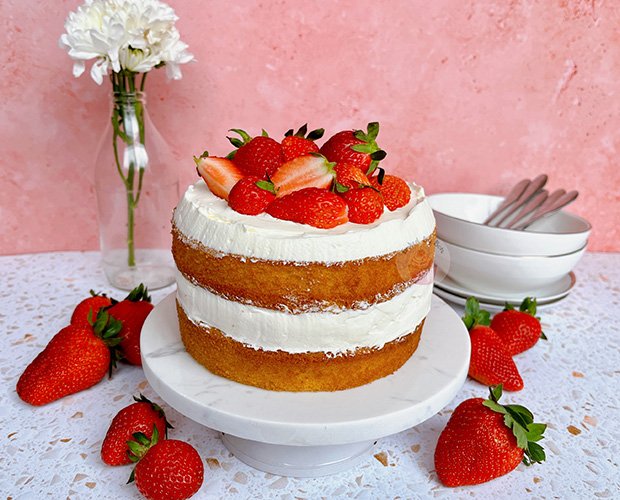
At what (x,y) coordinates should I click in order to perform the action: click on flower vase. Please return your answer as a coordinate pair (x, y). The height and width of the screenshot is (500, 620). Looking at the image, I should click on (108, 191).